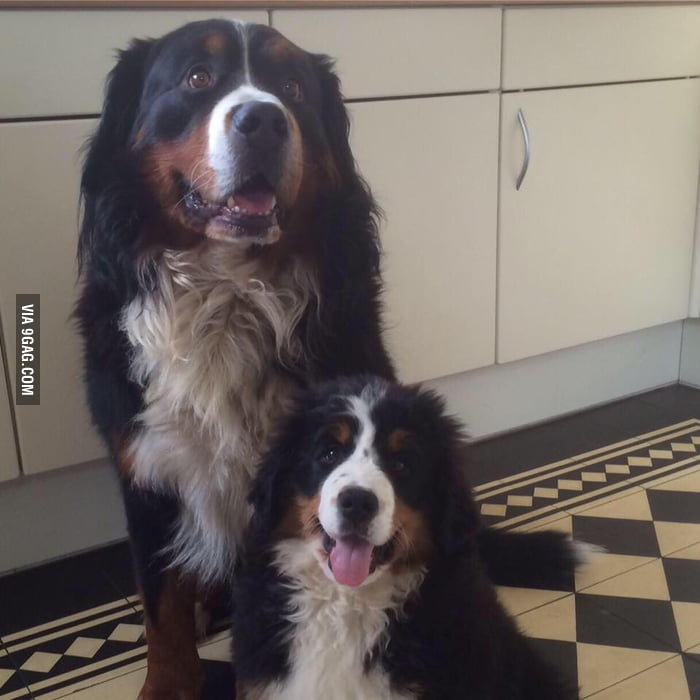
This screenshot has width=700, height=700. What are the coordinates of `cabinet door` in the screenshot? It's located at (460, 201).